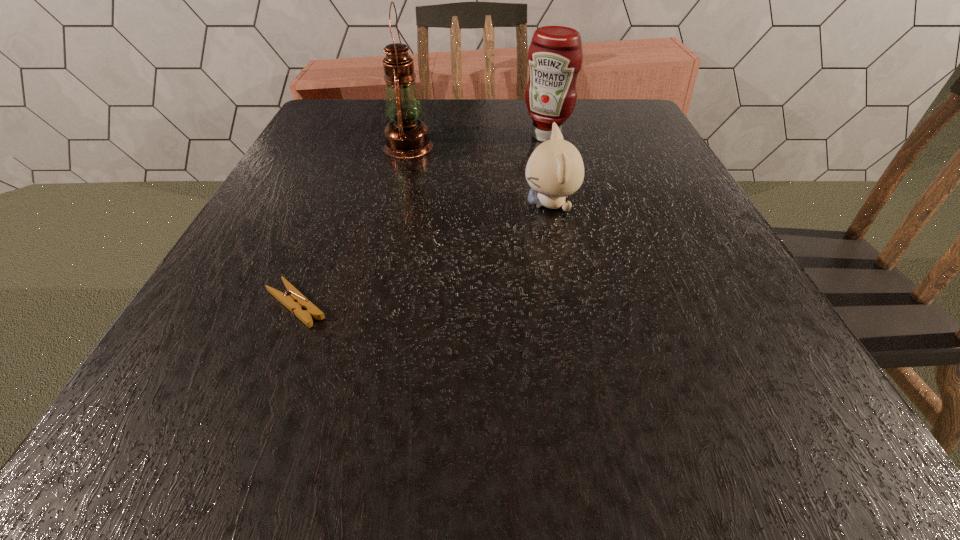
The width and height of the screenshot is (960, 540). Identify the location of vacant region located on the face of the third tallest object. (331, 204).

You are a GUI agent. You are given a task and a screenshot of the screen. Output one action in this format:
    pyautogui.click(x=<x>, y=<y>)
    Task: Click on the free region located 0.200m on the face of the third tallest object
    The image size is (960, 540).
    Given the screenshot: What is the action you would take?
    pyautogui.click(x=417, y=204)

Locate an element on the screen. The height and width of the screenshot is (540, 960). blank space located 0.160m on the front of the nearest object is located at coordinates (242, 440).

This screenshot has height=540, width=960. In order to click on oil lamp that is positioned at the far edge in this screenshot , I will do `click(406, 136)`.

The height and width of the screenshot is (540, 960). I want to click on condiment present at the far edge, so click(555, 56).

I want to click on object that is at the left edge, so click(x=296, y=302).

You are a GUI agent. You are given a task and a screenshot of the screen. Output one action in this format:
    pyautogui.click(x=<x>, y=<y>)
    Task: Click on the free spot at the far edge of the desktop
    This screenshot has height=540, width=960.
    Given the screenshot: What is the action you would take?
    pyautogui.click(x=439, y=119)

This screenshot has height=540, width=960. I want to click on vacant area at the near edge, so click(x=438, y=426).

At what (x,y) coordinates should I click in order to perform the action: click on vacant space at the left edge of the desktop. Please return your answer as a coordinate pair (x, y). Image resolution: width=960 pixels, height=540 pixels. Looking at the image, I should click on (275, 361).

Where is `free point at the right edge`? The image size is (960, 540). free point at the right edge is located at coordinates (780, 377).